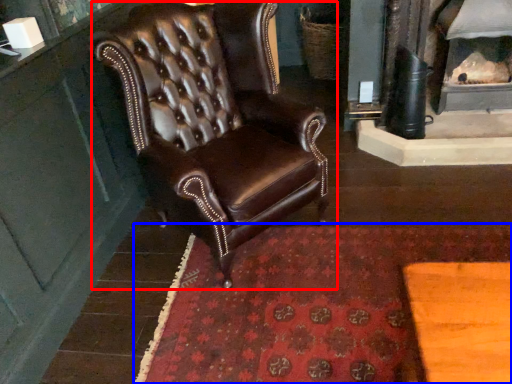
Question: Which object is further to the camera taking this photo, chair (highlighted by a red box) or mat (highlighted by a blue box)?

Choices:
 (A) chair
 (B) mat

Answer: (B)